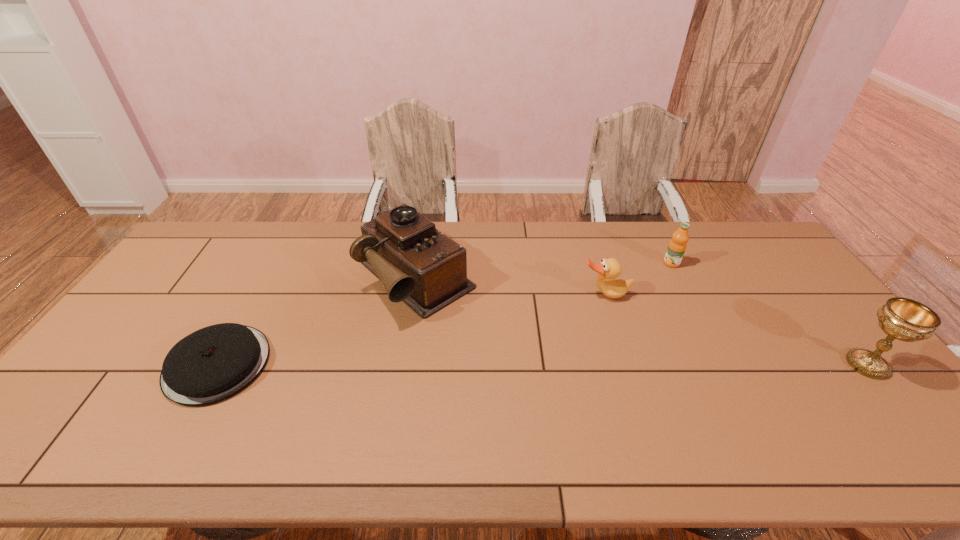
Identify the location of object that is at the right edge. (901, 318).

Locate an element on the screen. The image size is (960, 540). vacant space at the far edge of the desktop is located at coordinates (643, 249).

Identify the location of vacant space at the near edge of the desktop. This screenshot has width=960, height=540. (804, 409).

Where is `blank space at the left edge`? The image size is (960, 540). blank space at the left edge is located at coordinates (117, 353).

Locate an element on the screen. The width and height of the screenshot is (960, 540). vacant point at the right edge is located at coordinates (833, 377).

Image resolution: width=960 pixels, height=540 pixels. What are the coordinates of `free space between the rightmost object and the second object from right to left` in the screenshot? It's located at tap(769, 314).

Identify the location of vacant space that is in between the phonograph_record and the rightmost object. (641, 321).

Image resolution: width=960 pixels, height=540 pixels. Find the location of `unoccupied position between the shortest object and the phonograph_record`. unoccupied position between the shortest object and the phonograph_record is located at coordinates (316, 321).

Find the location of a particular element. The width and height of the screenshot is (960, 540). vacant area that lies between the shortest object and the rightmost object is located at coordinates (542, 364).

This screenshot has height=540, width=960. Find the location of `vacant point located between the pancake and the fourth object from left to right`. vacant point located between the pancake and the fourth object from left to right is located at coordinates (444, 314).